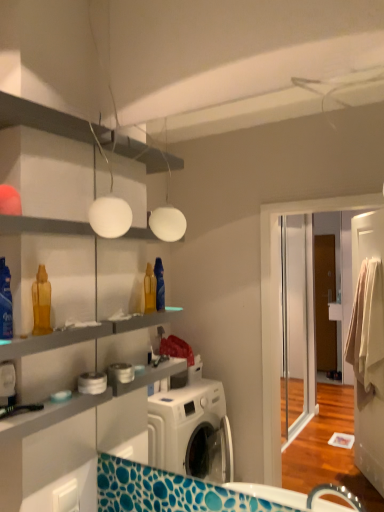
Question: Considering the positions of translucent plastic spray bottle at left, acting as the second cleaning product starting from the back, and translucent plastic bottle at left, the second cleaning product from the front, in the image, is translucent plastic spray bottle at left, acting as the second cleaning product starting from the back, wider or thinner than translucent plastic bottle at left, the second cleaning product from the front,?

Choices:
 (A) thin
 (B) wide

Answer: (A)

Question: Would you say translucent plastic spray bottle at left, acting as the second cleaning product starting from the back, is to the left or to the right of translucent plastic bottle at left, the second cleaning product from the front, in the picture?

Choices:
 (A) right
 (B) left

Answer: (B)

Question: Estimate the real-world distances between objects in this image. Which object is farther from the translucent plastic spray bottle at left, the 1th cleaning product when ordered from front to back?

Choices:
 (A) translucent plastic bottle at left, acting as the first cleaning product starting from the back
 (B) white matte globe at upper center

Answer: (B)

Question: Which is nearer to the translucent plastic spray bottle at left, acting as the second cleaning product starting from the back?

Choices:
 (A) white matte globe at upper center
 (B) translucent plastic bottle at left, the second cleaning product from the front

Answer: (B)